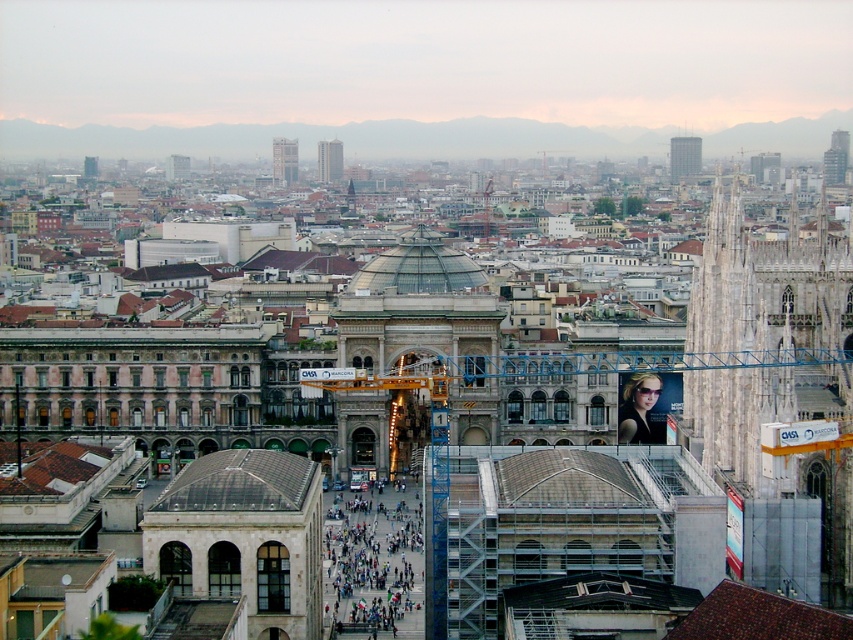
You are an architect evaluating the urban layout. Considering the shiny black sunglasses at center and the metallic glass skyscraper at upper right, which object takes up more area in the image?

The metallic glass skyscraper at upper right occupies more area than the shiny black sunglasses at center according to the description.

You are a city planner reviewing this area. The dark gray concrete plaza at center is currently under the smooth glass skyscraper at center. Is the plaza located directly below the skyscraper?

Yes, the dark gray concrete plaza at center is positioned under smooth glass skyscraper at center, so it is directly below the skyscraper.